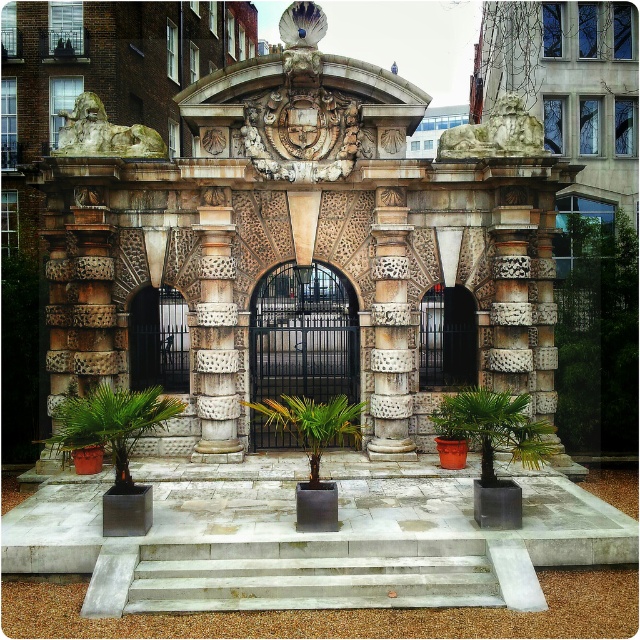
Question: Which of these objects is positioned farthest from the carved stone column at center?

Choices:
 (A) green leafy palm tree at center
 (B) marble column at center
 (C) green leafy palm at lower left

Answer: (B)

Question: Does black metal gate at center come behind marble column at center?

Choices:
 (A) no
 (B) yes

Answer: (B)

Question: Is black metal gate at center thinner than green leafy palm tree at center?

Choices:
 (A) yes
 (B) no

Answer: (A)

Question: Which point is closer to the camera taking this photo?

Choices:
 (A) (467, 432)
 (B) (356, 433)
 (C) (381, 593)
 (D) (202, 280)

Answer: (C)

Question: Which point is closer to the camera?

Choices:
 (A) (381, 248)
 (B) (524, 442)

Answer: (B)

Question: Can you confirm if green leafy palm at lower left is positioned to the right of green leafy palm tree at center?

Choices:
 (A) yes
 (B) no

Answer: (B)